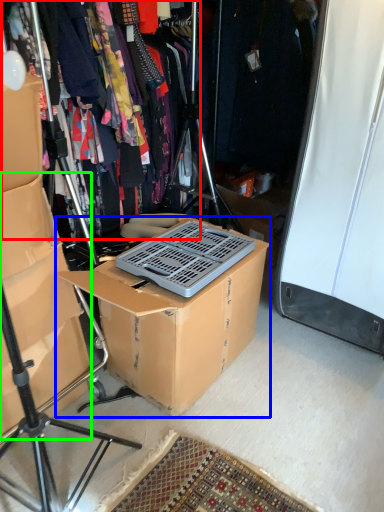
Question: Estimate the real-world distances between objects in this image. Which object is closer to clothing (highlighted by a red box), box (highlighted by a blue box) or storage box (highlighted by a green box)?

Choices:
 (A) box
 (B) storage box

Answer: (B)